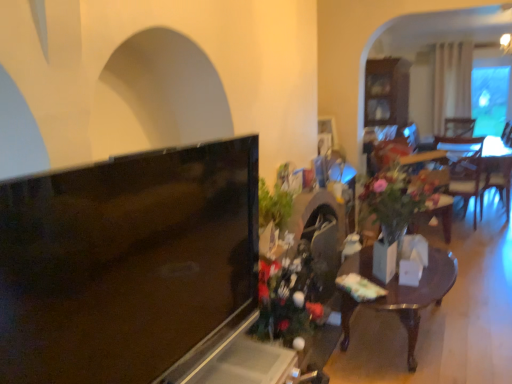
Question: Is green leafy plant at center-right further to the viewer compared to white glossy vase at center?

Choices:
 (A) yes
 (B) no

Answer: (A)

Question: Are green leafy plant at center-right and white glossy vase at center far apart?

Choices:
 (A) yes
 (B) no

Answer: (B)

Question: Does green leafy plant at center-right appear on the right side of white glossy vase at center?

Choices:
 (A) no
 (B) yes

Answer: (B)

Question: Is green leafy plant at center-right wider than white glossy vase at center?

Choices:
 (A) no
 (B) yes

Answer: (B)

Question: Is green leafy plant at center-right facing towards white glossy vase at center?

Choices:
 (A) yes
 (B) no

Answer: (B)

Question: From the image's perspective, is green leafy plant at center-right located beneath white glossy vase at center?

Choices:
 (A) no
 (B) yes

Answer: (A)

Question: Is wooden table at center touching matte black tv at left?

Choices:
 (A) yes
 (B) no

Answer: (B)

Question: Is wooden table at center oriented towards matte black tv at left?

Choices:
 (A) no
 (B) yes

Answer: (A)

Question: From a real-world perspective, is wooden table at center over matte black tv at left?

Choices:
 (A) yes
 (B) no

Answer: (B)

Question: Is wooden table at center shorter than matte black tv at left?

Choices:
 (A) yes
 (B) no

Answer: (A)

Question: Is wooden table at center behind matte black tv at left?

Choices:
 (A) yes
 (B) no

Answer: (A)

Question: Is wooden table at center bigger than matte black tv at left?

Choices:
 (A) no
 (B) yes

Answer: (B)

Question: Would you consider matte black tv at left to be distant from white glossy vase at center?

Choices:
 (A) yes
 (B) no

Answer: (A)